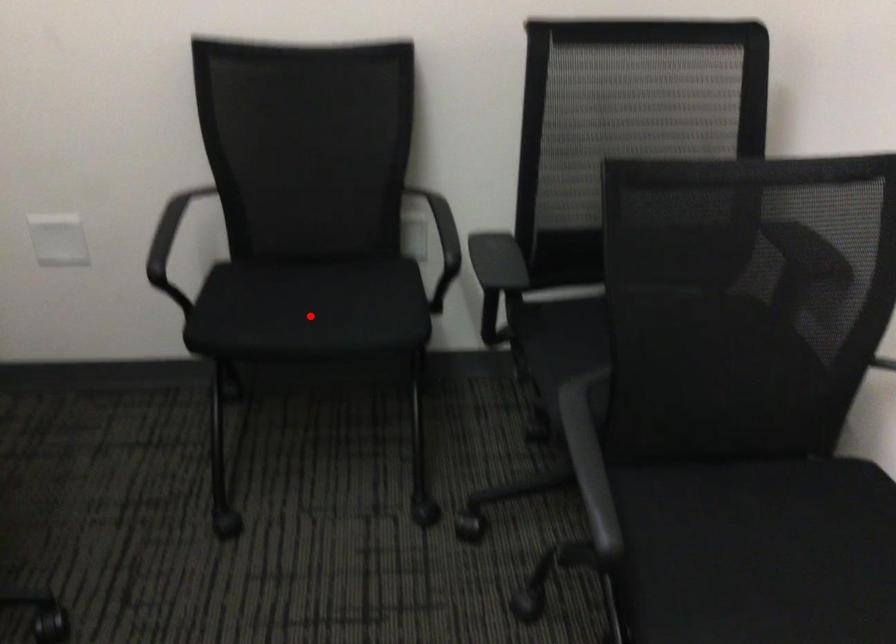
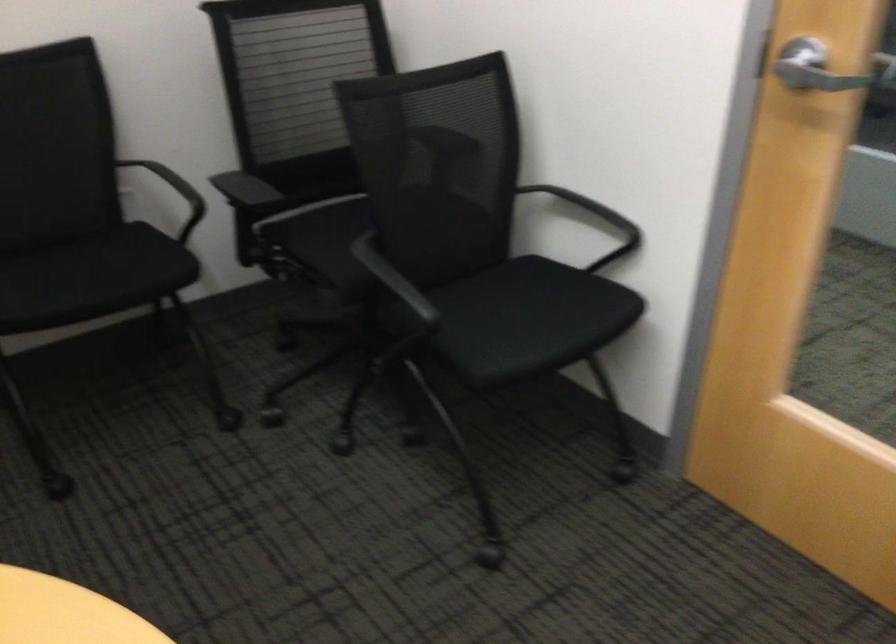
Find the pixel in the second image that matches the highlighted location in the first image.

(91, 278)